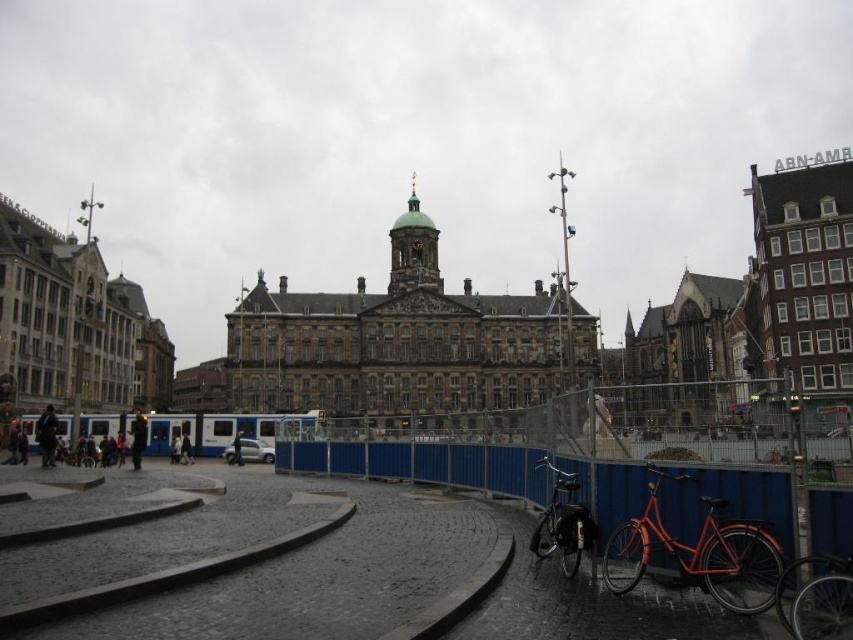
Can you confirm if blue plastic fence at lower right is thinner than orange matte bicycle at lower right?

In fact, blue plastic fence at lower right might be wider than orange matte bicycle at lower right.

Which is in front, point (276, 460) or point (796, 595)?

Point (796, 595) is in front.

You are a GUI agent. You are given a task and a screenshot of the screen. Output one action in this format:
    pyautogui.click(x=<x>, y=<y>)
    Task: Click on the blue plastic fence at lower right
    The image size is (853, 640).
    Given the screenshot: What is the action you would take?
    pyautogui.click(x=422, y=465)

Can you confirm if orange matte bicycle at lower right is positioned above gold domed tower at center?

Incorrect, orange matte bicycle at lower right is not positioned above gold domed tower at center.

Is point (830, 625) positioned in front of point (405, 237)?

Yes, it is in front of point (405, 237).

Is point (810, 577) positioned before point (413, 244)?

Yes, point (810, 577) is in front of point (413, 244).

This screenshot has width=853, height=640. In order to click on orange matte bicycle at lower right in this screenshot , I will do `click(816, 596)`.

Does blue plastic fence at lower right come behind shiny black bicycle at lower right?

No, blue plastic fence at lower right is closer to the viewer.

Is point (480, 461) closer to camera compared to point (579, 545)?

No, it is behind (579, 545).

This screenshot has height=640, width=853. Find the location of `blue plastic fence at lower right`. blue plastic fence at lower right is located at coordinates (422, 465).